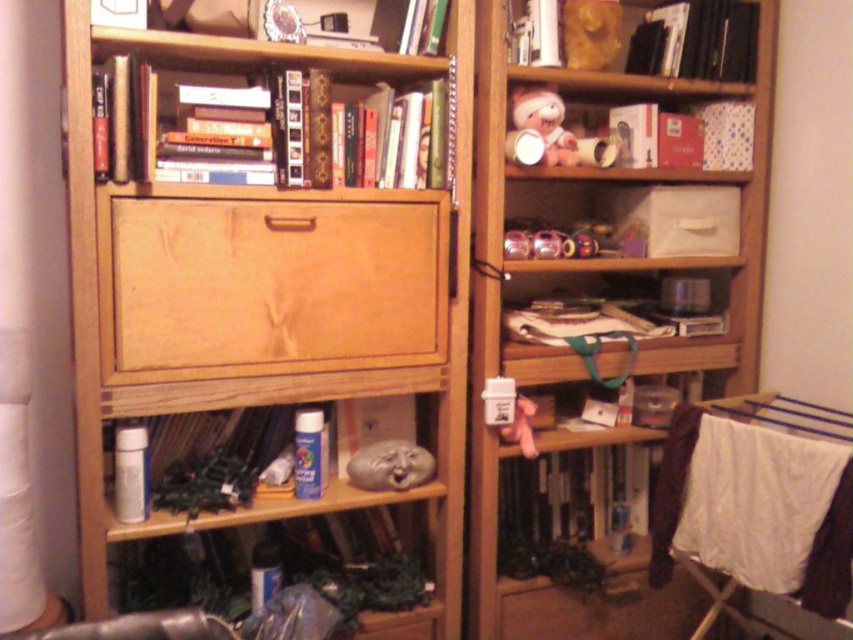
You are organizing the items on the bookshelf and notice the matte cardboard box at upper center and the hardcover books at upper center. Which item takes up more space on the shelf?

The hardcover books at upper center take up more space than the matte cardboard box at upper center because the matte cardboard box is smaller.

You are a person who is 1.7 meters tall. You want to reach the wooden drawer at center to open it. Can you reach it without standing on something?

The wooden drawer at center is 1.54 meters away from the viewer. Since the average reach height for a person is about 0.2 meters above their height, your maximum reach would be approximately 1.9 meters. The wooden drawer at center is 1.54 meters away, so yes, you can reach it without needing to stand on something.

Consider the image. You are organizing items on the wooden bookshelf and need to place a new item between the hardcover book at center and the hardcover books at upper center. Based on their positions, which one is closer to you so you can place the new item appropriately?

The hardcover book at center is closer to you than the hardcover books at upper center, so you should place the new item between them accordingly.